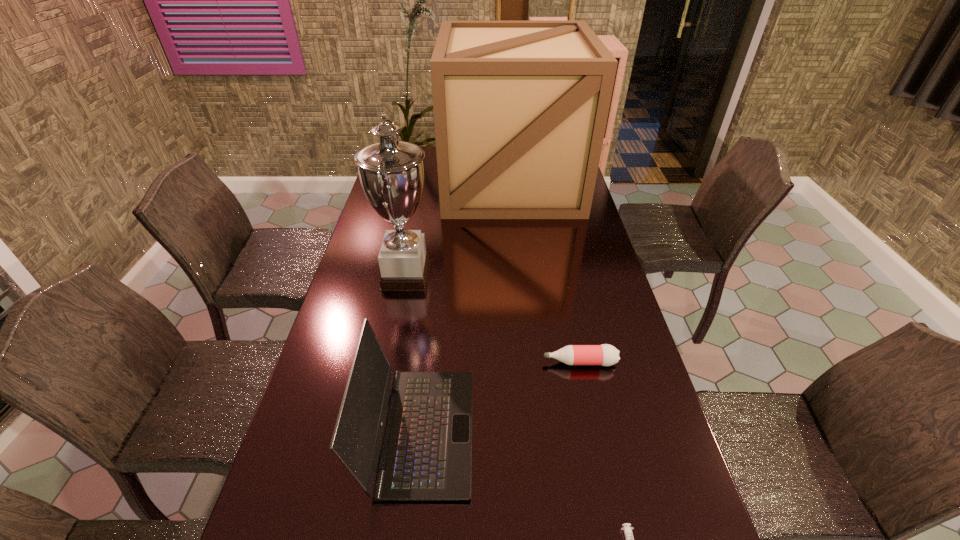
Locate an element on the screen. The width and height of the screenshot is (960, 540). box is located at coordinates (520, 108).

At what (x,y) coordinates should I click in order to perform the action: click on the second farthest object. Please return your answer as a coordinate pair (x, y). The width and height of the screenshot is (960, 540). Looking at the image, I should click on (391, 172).

The width and height of the screenshot is (960, 540). What are the coordinates of `the third tallest object` in the screenshot? It's located at pos(426,451).

At what (x,y) coordinates should I click in order to perform the action: click on the fourth farthest object. Please return your answer as a coordinate pair (x, y). Looking at the image, I should click on (426, 451).

Locate an element on the screen. The image size is (960, 540). bottle is located at coordinates (606, 355).

Where is `the second shortest object`? the second shortest object is located at coordinates (606, 355).

The width and height of the screenshot is (960, 540). What are the coordinates of `vacant space located 0.100m on the reinforced sides of the box` in the screenshot? It's located at (516, 234).

The width and height of the screenshot is (960, 540). What are the coordinates of `free space located at the front view of the trophy cup` in the screenshot? It's located at (495, 276).

At what (x,y) coordinates should I click in order to perform the action: click on free point located 0.340m on the screen of the third tallest object. Please return your answer as a coordinate pair (x, y). This screenshot has height=540, width=960. Looking at the image, I should click on (x=616, y=432).

Image resolution: width=960 pixels, height=540 pixels. I want to click on vacant space positioned 0.360m with the cap open on the second shortest object, so click(410, 362).